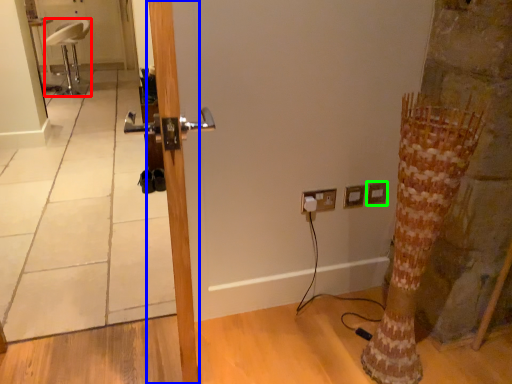
Question: Which object is the closest to the chair (highlighted by a red box)? Choose among these: door (highlighted by a blue box) or electric outlet (highlighted by a green box).

Choices:
 (A) door
 (B) electric outlet

Answer: (B)